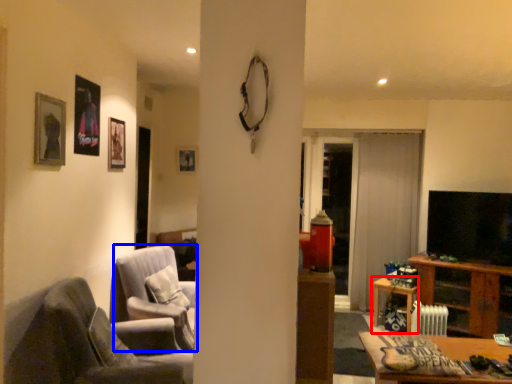
Question: Which object appears farthest to the camera in this image, table (highlighted by a red box) or chair (highlighted by a blue box)?

Choices:
 (A) table
 (B) chair

Answer: (A)